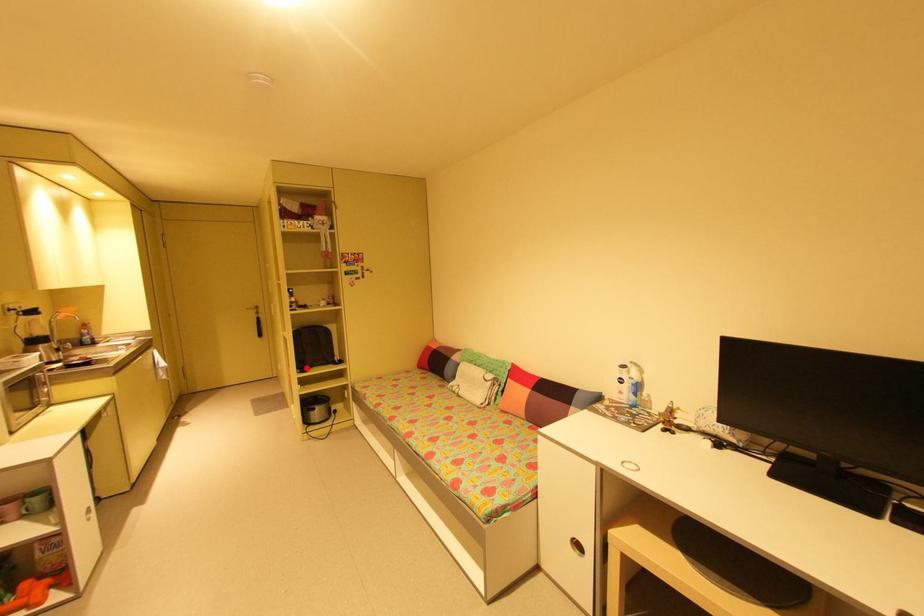
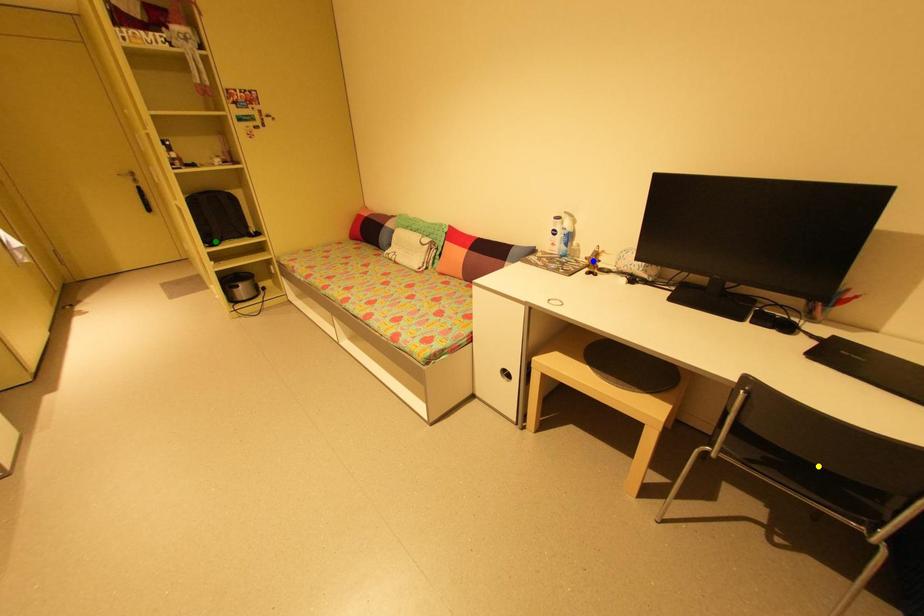
Question: I am providing you with two images of the same scene from different viewpoints. A red point is marked on the first image. You are given multiple points on the second image. Can you choose the point in image 2 that corresponds to the point in image 1?

Choices:
 (A) green point
 (B) yellow point
 (C) blue point

Answer: (A)